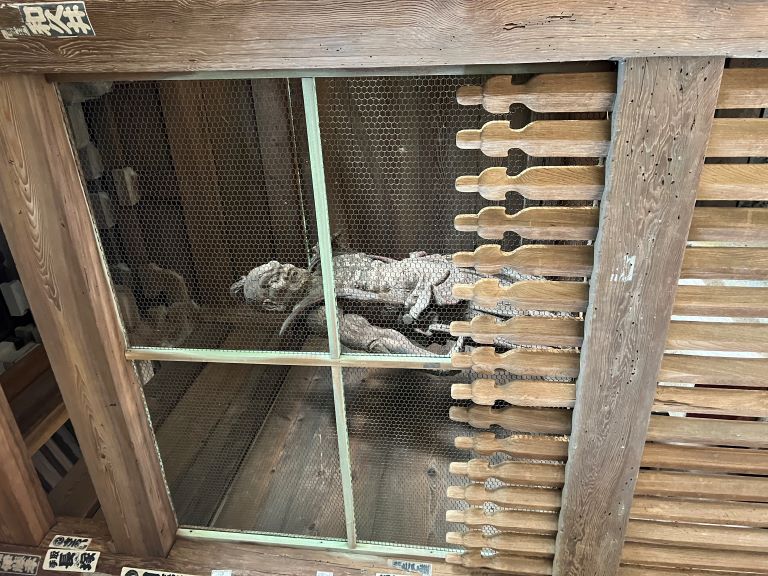
Where is `left side wall`? This screenshot has width=768, height=576. left side wall is located at coordinates (143, 230), (141, 313).